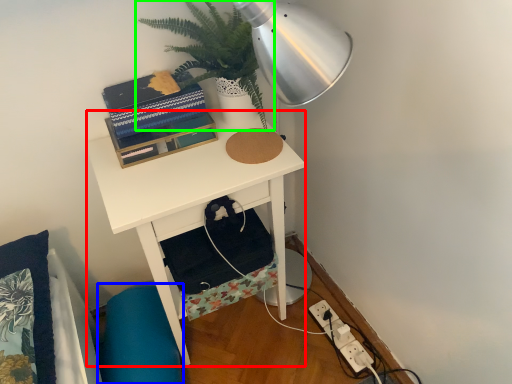
Question: Which object is the closest to the desk (highlighted by a red box)? Choose among these: swivel chair (highlighted by a blue box) or houseplant (highlighted by a green box).

Choices:
 (A) swivel chair
 (B) houseplant

Answer: (B)